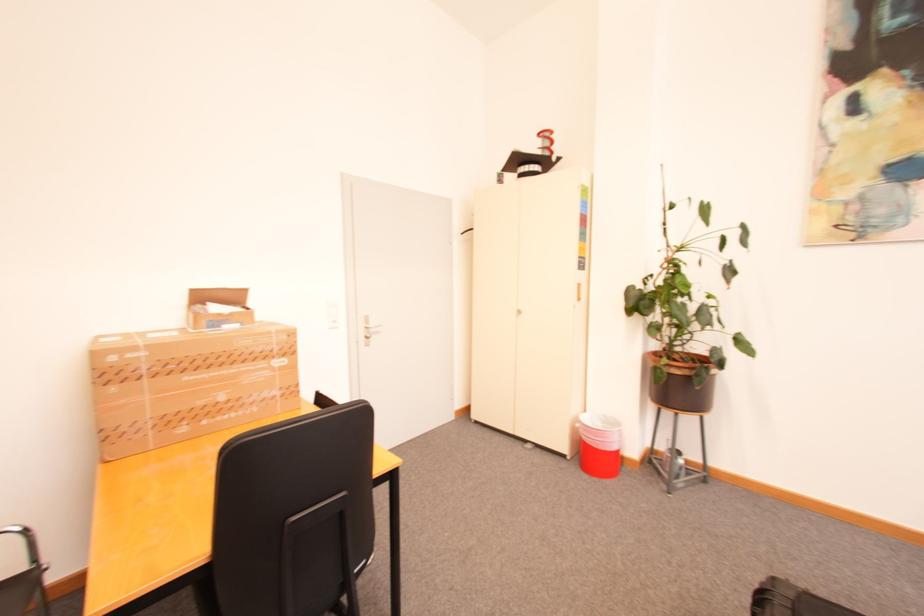
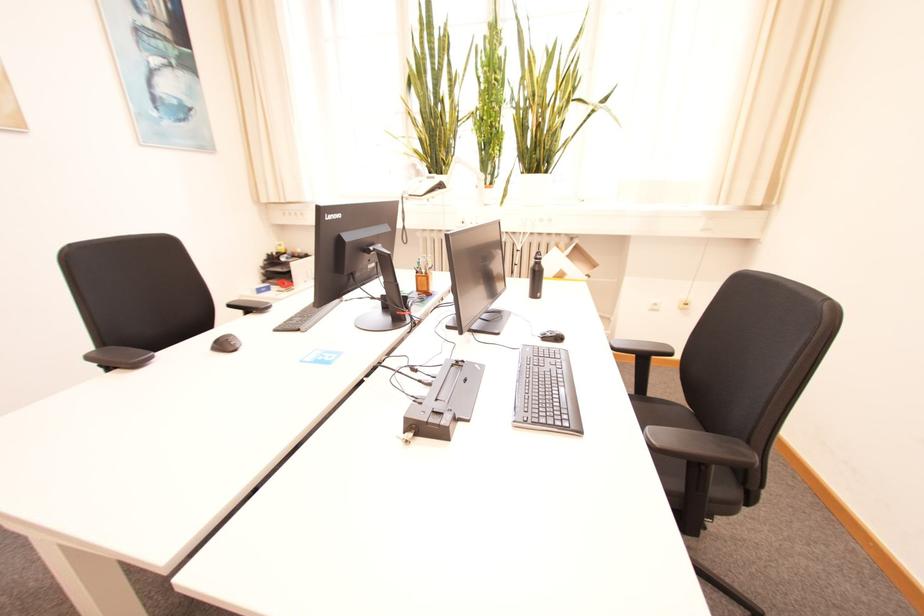
The first image is from the beginning of the video and the second image is from the end. How did the camera likely rotate when shooting the video?

The rotation direction of the camera is right-down.